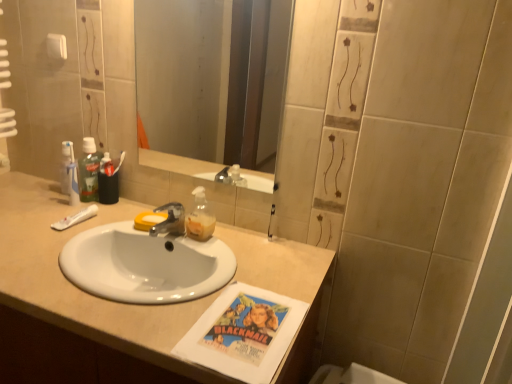
The image size is (512, 384). Identify the location of free spot to the left of metallic silver faucet at center. (106, 228).